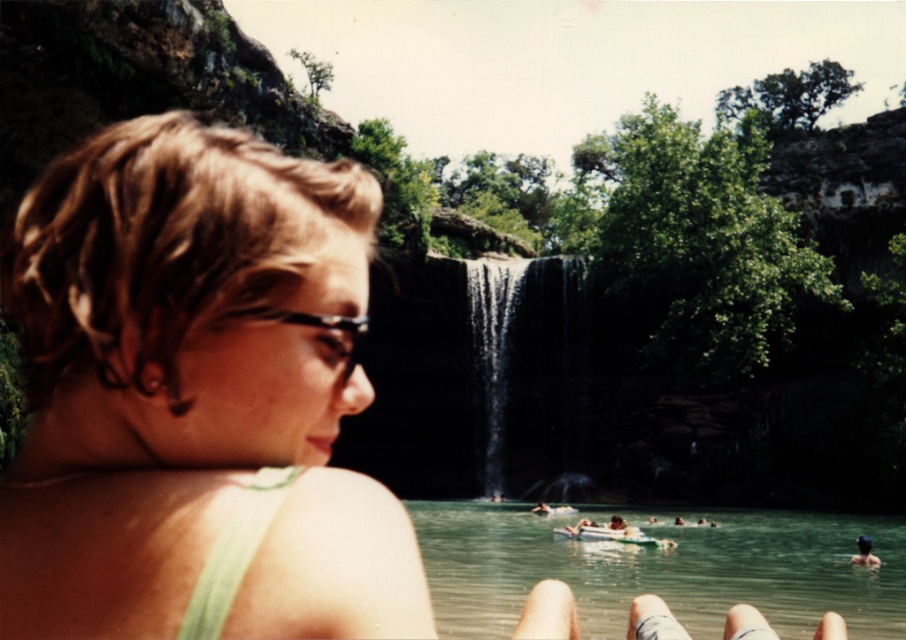
Is green fabric bikini top at center thinner than black glossy waterfall at center?

In fact, green fabric bikini top at center might be wider than black glossy waterfall at center.

Who is more forward, [97,500] or [490,320]?

Point [97,500] is more forward.

Find the location of a particular element. The width and height of the screenshot is (906, 640). green fabric bikini top at center is located at coordinates (193, 390).

Can you confirm if green water at lower center is positioned above black glossy waterfall at center?

No.

Which is in front, point (901, 538) or point (466, 269)?

Point (901, 538)

Between point (485, 592) and point (513, 324), which one is positioned in front?

Positioned in front is point (485, 592).

Find the location of a particular element. green water at lower center is located at coordinates (661, 568).

Which of these two, green fabric bikini top at center or green water at lower center, stands taller?

With more height is green fabric bikini top at center.

How much distance is there between green fabric bikini top at center and green water at lower center?

green fabric bikini top at center is 35.59 meters away from green water at lower center.

Image resolution: width=906 pixels, height=640 pixels. Identify the location of green fabric bikini top at center. (193, 390).